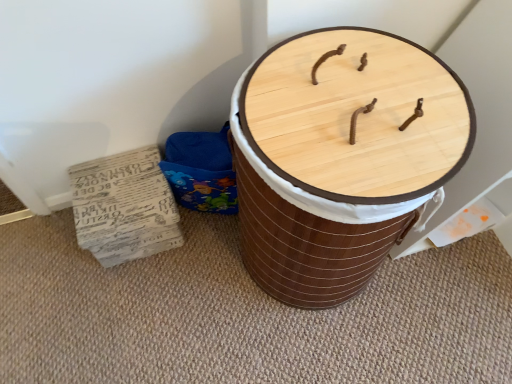
The image size is (512, 384). Find the location of `recycled paper stack at lower left`. recycled paper stack at lower left is located at coordinates (124, 207).

What do you see at coordinates (124, 207) in the screenshot?
I see `recycled paper stack at lower left` at bounding box center [124, 207].

Image resolution: width=512 pixels, height=384 pixels. I want to click on wooden barrel at center, so click(x=340, y=158).

What is the approximate width of wooden barrel at center?

wooden barrel at center is 37.22 centimeters in width.

Image resolution: width=512 pixels, height=384 pixels. What do you see at coordinates (340, 158) in the screenshot?
I see `wooden barrel at center` at bounding box center [340, 158].

The width and height of the screenshot is (512, 384). I want to click on recycled paper stack at lower left, so tap(124, 207).

Can you confirm if recycled paper stack at lower left is positioned to the right of wooden barrel at center?

Incorrect, recycled paper stack at lower left is not on the right side of wooden barrel at center.

Which object is closer to the camera taking this photo, recycled paper stack at lower left or wooden barrel at center?

wooden barrel at center.

Is point (126, 250) farther from camera compared to point (419, 190)?

Yes.

From the image's perspective, is recycled paper stack at lower left positioned above or below wooden barrel at center?

Clearly, from the image's perspective, recycled paper stack at lower left is below wooden barrel at center.

From a real-world perspective, is recycled paper stack at lower left under wooden barrel at center?

Yes, from a real-world perspective, recycled paper stack at lower left is under wooden barrel at center.

Can you confirm if recycled paper stack at lower left is wider than wooden barrel at center?

No, recycled paper stack at lower left is not wider than wooden barrel at center.

Between recycled paper stack at lower left and wooden barrel at center, which one has less height?

With less height is recycled paper stack at lower left.

Considering the sizes of objects recycled paper stack at lower left and wooden barrel at center in the image provided, who is bigger, recycled paper stack at lower left or wooden barrel at center?

wooden barrel at center.

Is recycled paper stack at lower left located outside wooden barrel at center?

That's correct, recycled paper stack at lower left is outside of wooden barrel at center.

Is recycled paper stack at lower left next to wooden barrel at center?

No, recycled paper stack at lower left is not next to wooden barrel at center.

Could you tell me if recycled paper stack at lower left is turned towards wooden barrel at center?

No, recycled paper stack at lower left is not turned towards wooden barrel at center.

From the picture: What's the angular difference between recycled paper stack at lower left and wooden barrel at center's facing directions?

The angle between the facing direction of recycled paper stack at lower left and the facing direction of wooden barrel at center is 0.000534 degrees.

The image size is (512, 384). Identify the location of cardboard behind the wooden barrel at center. (124, 207).

Is wooden barrel at center to the left or to the right of recycled paper stack at lower left in the image?

Clearly, wooden barrel at center is on the right of recycled paper stack at lower left in the image.

Relative to recycled paper stack at lower left, is wooden barrel at center in front or behind?

wooden barrel at center is in front of recycled paper stack at lower left.

Which is closer to the camera, [303,290] or [101,257]?

Point [303,290] is positioned closer to the camera compared to point [101,257].

From the image's perspective, would you say wooden barrel at center is positioned over recycled paper stack at lower left?

Yes, from the image's perspective, wooden barrel at center is over recycled paper stack at lower left.

From a real-world perspective, who is located higher, wooden barrel at center or recycled paper stack at lower left?

wooden barrel at center.

Between wooden barrel at center and recycled paper stack at lower left, which one has smaller width?

With smaller width is recycled paper stack at lower left.

Considering the sizes of objects wooden barrel at center and recycled paper stack at lower left in the image provided, who is taller, wooden barrel at center or recycled paper stack at lower left?

Standing taller between the two is wooden barrel at center.

Between wooden barrel at center and recycled paper stack at lower left, which one has larger size?

wooden barrel at center.

Looking at this image, can we say wooden barrel at center lies outside recycled paper stack at lower left?

Absolutely, wooden barrel at center is external to recycled paper stack at lower left.

Are wooden barrel at center and recycled paper stack at lower left beside each other?

No, wooden barrel at center is not next to recycled paper stack at lower left.

Is wooden barrel at center aimed at recycled paper stack at lower left?

No, wooden barrel at center is not oriented towards recycled paper stack at lower left.

Can you tell me how much wooden barrel at center and recycled paper stack at lower left differ in facing direction?

0.000534 degrees separate the facing orientations of wooden barrel at center and recycled paper stack at lower left.

Image resolution: width=512 pixels, height=384 pixels. In order to click on cardboard that is below the wooden barrel at center (from the image's perspective) in this screenshot , I will do `click(124, 207)`.

Where is `cardboard beneath the wooden barrel at center (from a real-world perspective)`? The height and width of the screenshot is (384, 512). cardboard beneath the wooden barrel at center (from a real-world perspective) is located at coordinates (124, 207).

This screenshot has width=512, height=384. In order to click on cardboard to the left of wooden barrel at center in this screenshot , I will do `click(124, 207)`.